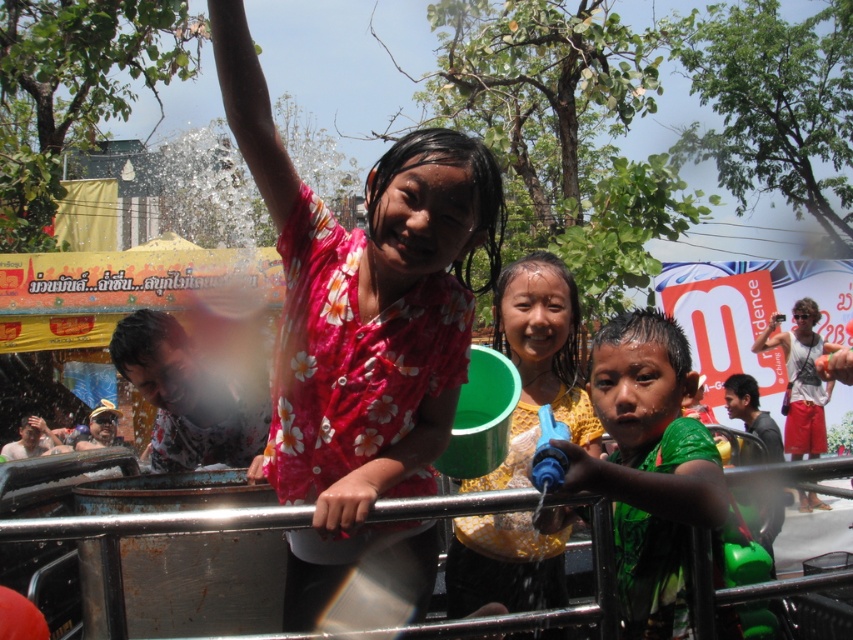
You are a photographer trying to capture the child in the yellow floral shirt at center. The camera is currently focused on point (x=538, y=358). Is the point on the correct subject?

Yes, the point (x=538, y=358) is on the yellow floral shirt at center, so it is focused on the correct subject.